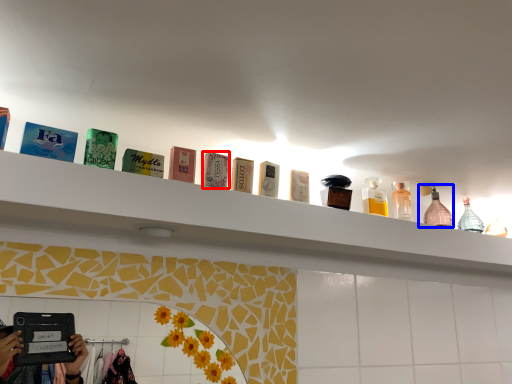
Question: Which object appears closest to the camera in this image, toiletry (highlighted by a red box) or mouthwash (highlighted by a blue box)?

Choices:
 (A) toiletry
 (B) mouthwash

Answer: (A)